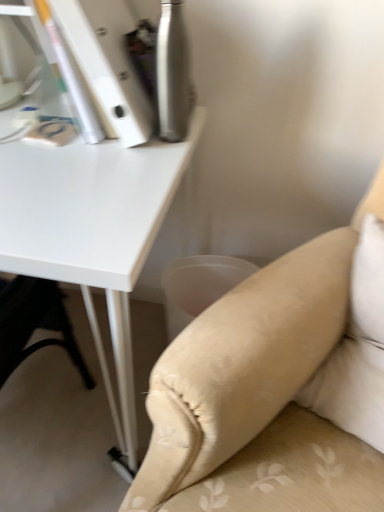
Question: Is beige fabric pillow at lower right in front of or behind white matte table at upper left in the image?

Choices:
 (A) front
 (B) behind

Answer: (A)

Question: In terms of size, does beige fabric pillow at lower right appear bigger or smaller than white matte table at upper left?

Choices:
 (A) big
 (B) small

Answer: (B)

Question: Which is nearer to the beige fabric couch at lower right?

Choices:
 (A) beige fabric pillow at lower right
 (B) white matte table at upper left

Answer: (A)

Question: Which object is positioned farthest from the white matte table at upper left?

Choices:
 (A) beige fabric couch at lower right
 (B) beige fabric pillow at lower right

Answer: (B)